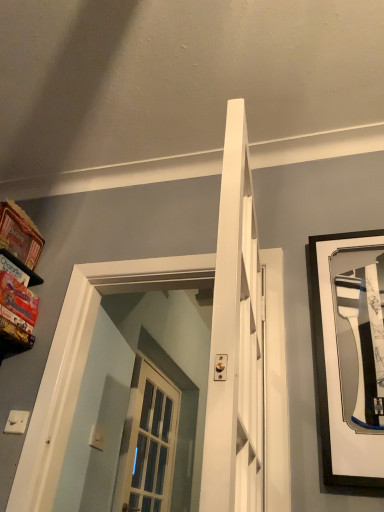
In order to face white plastic light switch at lower left, should I rotate leftwards or rightwards?

To face it directly, rotate left by 22.449 degrees.

This screenshot has height=512, width=384. I want to click on white plastic light switch at lower left, so click(16, 422).

Which is in front, point (24, 347) or point (15, 423)?

The point (15, 423) is more forward.

From the image's perspective, which one is positioned lower, matte cardboard shelf at left or white plastic light switch at lower left?

white plastic light switch at lower left is shown below in the image.

Is matte cardboard shelf at left closer to camera compared to white plastic light switch at lower left?

No, matte cardboard shelf at left is further to the viewer.

Is point (27, 411) closer to camera compared to point (347, 321)?

No, (27, 411) is further to viewer.

Between white plastic light switch at lower left and black matte picture frame at right, which one has smaller size?

white plastic light switch at lower left.

Can black matte picture frame at right be found inside white plastic light switch at lower left?

No.

Would you consider white plastic light switch at lower left to be distant from black matte picture frame at right?

Yes, white plastic light switch at lower left and black matte picture frame at right are located far from each other.

Is black matte picture frame at right oriented towards white plastic light switch at lower left?

No, black matte picture frame at right is not oriented towards white plastic light switch at lower left.

Locate an element on the screen. The height and width of the screenshot is (512, 384). picture frame that appears in front of the white plastic light switch at lower left is located at coordinates (349, 354).

Is black matte picture frame at right at the right side of white plastic light switch at lower left?

Yes.

From the picture: Is white plastic light switch at lower left not close to matte cardboard shelf at left?

They are positioned close to each other.

Considering the relative positions of white plastic light switch at lower left and matte cardboard shelf at left in the image provided, is white plastic light switch at lower left behind matte cardboard shelf at left?

No, white plastic light switch at lower left is in front of matte cardboard shelf at left.

Between point (10, 412) and point (2, 292), which one is positioned behind?

The point (2, 292) is farther.

Does white plastic light switch at lower left have a smaller size compared to matte cardboard shelf at left?

Correct, white plastic light switch at lower left occupies less space than matte cardboard shelf at left.

From the image's perspective, relative to black matte picture frame at right, is matte cardboard shelf at left above or below?

Clearly, from the image's perspective, matte cardboard shelf at left is above black matte picture frame at right.

Does matte cardboard shelf at left have a greater height compared to black matte picture frame at right?

No.

Is the surface of matte cardboard shelf at left in direct contact with black matte picture frame at right?

No, matte cardboard shelf at left is not beside black matte picture frame at right.

Can you confirm if black matte picture frame at right is thinner than matte cardboard shelf at left?

Yes, black matte picture frame at right is thinner than matte cardboard shelf at left.

How much distance is there between black matte picture frame at right and matte cardboard shelf at left?

A distance of 4.23 feet exists between black matte picture frame at right and matte cardboard shelf at left.

Can you tell me how much black matte picture frame at right and matte cardboard shelf at left differ in facing direction?

black matte picture frame at right and matte cardboard shelf at left are facing 0.685 degrees away from each other.

Would you say black matte picture frame at right is inside or outside matte cardboard shelf at left?

black matte picture frame at right is not inside matte cardboard shelf at left, it's outside.

This screenshot has width=384, height=512. I want to click on light switch that appears in front of the matte cardboard shelf at left, so click(x=16, y=422).

The width and height of the screenshot is (384, 512). I want to click on picture frame that appears above the white plastic light switch at lower left (from the image's perspective), so pos(349,354).

Looking at the image, which one is located closer to black matte picture frame at right, white plastic light switch at lower left or matte cardboard shelf at left?

Based on the image, white plastic light switch at lower left appears to be nearer to black matte picture frame at right.

From the picture: Looking at the image, which one is located further to black matte picture frame at right, matte cardboard shelf at left or white plastic light switch at lower left?

matte cardboard shelf at left lies further to black matte picture frame at right than the other object.

From the image, which object appears to be nearer to white plastic light switch at lower left, black matte picture frame at right or matte cardboard shelf at left?

The object closer to white plastic light switch at lower left is matte cardboard shelf at left.

Which object lies nearer to the anchor point matte cardboard shelf at left, white plastic light switch at lower left or black matte picture frame at right?

white plastic light switch at lower left is closer to matte cardboard shelf at left.

Looking at the image, which one is located closer to matte cardboard shelf at left, black matte picture frame at right or white plastic light switch at lower left?

white plastic light switch at lower left.

In the scene shown: Which object lies nearer to the anchor point white plastic light switch at lower left, matte cardboard shelf at left or black matte picture frame at right?

matte cardboard shelf at left lies closer to white plastic light switch at lower left than the other object.

Where is `light switch between matte cardboard shelf at left and black matte picture frame at right from left to right`? light switch between matte cardboard shelf at left and black matte picture frame at right from left to right is located at coordinates (16, 422).